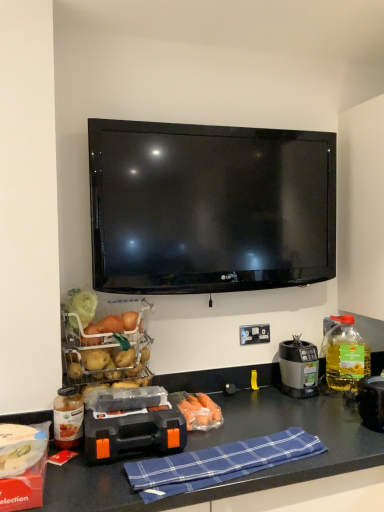
Question: From the image's perspective, relative to orange plastic toolbox at center, is black plastic blender at right above or below?

Choices:
 (A) below
 (B) above

Answer: (B)

Question: From a real-world perspective, is black plastic blender at right positioned above or below orange plastic toolbox at center?

Choices:
 (A) below
 (B) above

Answer: (B)

Question: Which object is the farthest from the black plastic electrical outlet at center?

Choices:
 (A) yellow translucent bottle at right, which is the second bottle in front-to-back order
 (B) matte red box at lower left
 (C) orange translucent carrots at center
 (D) translucent glass jar at lower left, which appears as the 2th bottle when viewed from the back
 (E) blue plaid cloth at lower center

Answer: (B)

Question: Which object is positioned closest to the matte red box at lower left?

Choices:
 (A) orange plastic toolbox at center
 (B) black plastic blender at right
 (C) translucent glass jar at lower left, which appears as the 2th bottle when viewed from the back
 (D) black plastic electrical outlet at center
 (E) blue plaid cloth at lower center

Answer: (C)